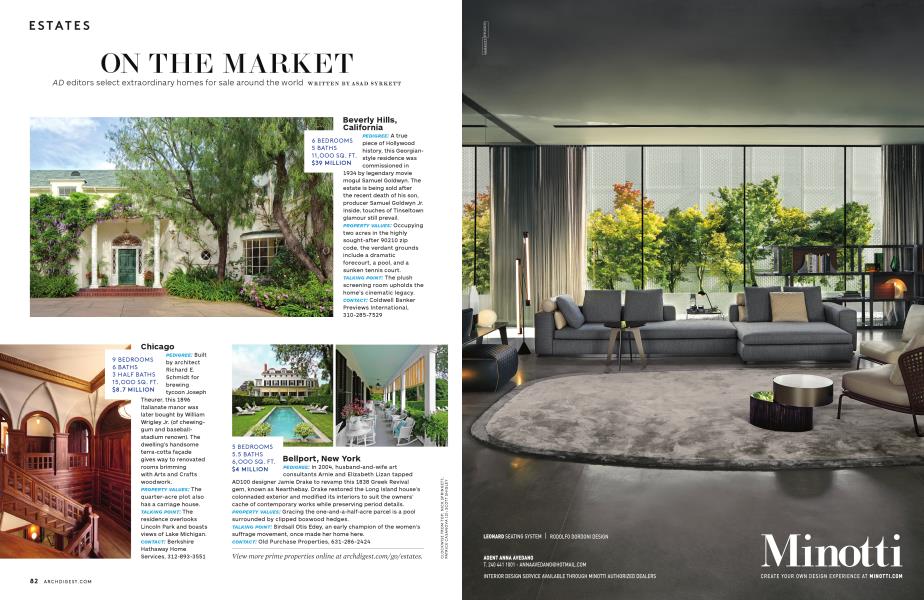
Find the location of a particular element. coffee table is located at coordinates (625, 323).